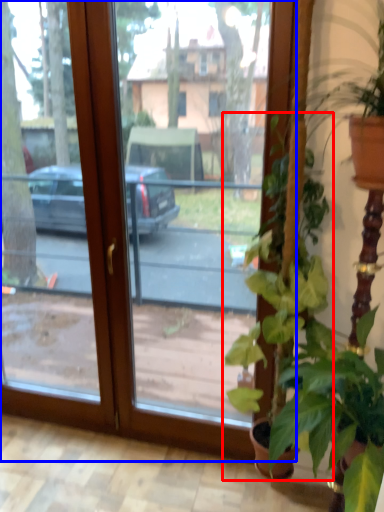
Question: Which point is further to the camera, houseplant (highlighted by a red box) or window (highlighted by a blue box)?

Choices:
 (A) houseplant
 (B) window

Answer: (B)